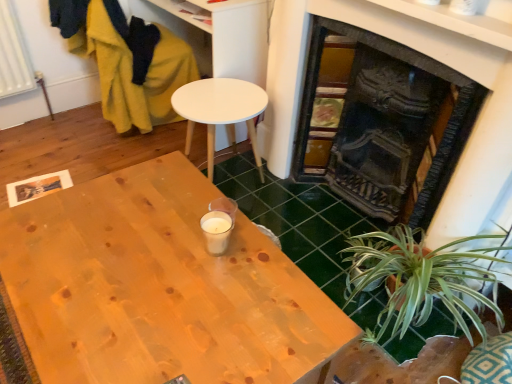
Question: Is white matte table at center positioned with its back to natural wood desk at center?

Choices:
 (A) no
 (B) yes

Answer: (A)

Question: Is white matte table at center at the right side of natural wood desk at center?

Choices:
 (A) no
 (B) yes

Answer: (B)

Question: Is white matte table at center placed right next to natural wood desk at center?

Choices:
 (A) no
 (B) yes

Answer: (A)

Question: Is white matte table at center positioned in front of natural wood desk at center?

Choices:
 (A) no
 (B) yes

Answer: (A)

Question: Considering the relative sizes of white matte table at center and natural wood desk at center in the image provided, is white matte table at center taller than natural wood desk at center?

Choices:
 (A) no
 (B) yes

Answer: (A)

Question: Is natural wood desk at center inside white matte table at center?

Choices:
 (A) no
 (B) yes

Answer: (A)

Question: Considering the relative sizes of green leafy plant at lower right and white matte table at center in the image provided, is green leafy plant at lower right bigger than white matte table at center?

Choices:
 (A) yes
 (B) no

Answer: (A)

Question: Does green leafy plant at lower right lie behind white matte table at center?

Choices:
 (A) yes
 (B) no

Answer: (B)

Question: Is green leafy plant at lower right next to white matte table at center and touching it?

Choices:
 (A) no
 (B) yes

Answer: (A)

Question: Would you say white matte table at center is part of green leafy plant at lower right's contents?

Choices:
 (A) yes
 (B) no

Answer: (B)

Question: Could you tell me if green leafy plant at lower right is turned towards white matte table at center?

Choices:
 (A) no
 (B) yes

Answer: (A)

Question: From a real-world perspective, does green leafy plant at lower right stand above white matte table at center?

Choices:
 (A) no
 (B) yes

Answer: (A)

Question: Can you confirm if velvet mustard yellow swivel chair at left is taller than white matte table at center?

Choices:
 (A) yes
 (B) no

Answer: (A)